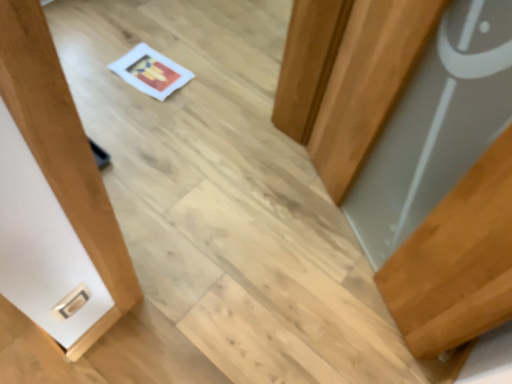
This screenshot has width=512, height=384. Identify the location of silver metallic door handle at lower left. (72, 302).

What do you see at coordinates (72, 302) in the screenshot?
I see `silver metallic door handle at lower left` at bounding box center [72, 302].

Locate an element on the screen. The image size is (512, 384). silver metallic door handle at lower left is located at coordinates (72, 302).